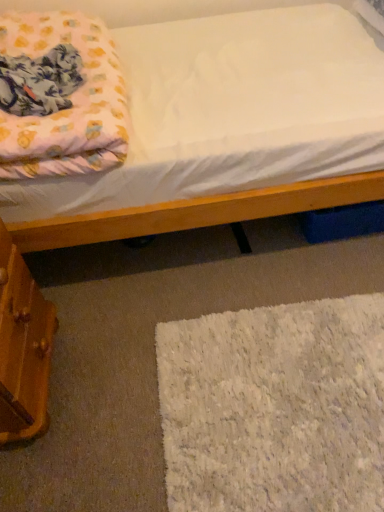
The height and width of the screenshot is (512, 384). What are the coordinates of `unoccupied space behind wooden drawer at lower left` in the screenshot? It's located at (79, 283).